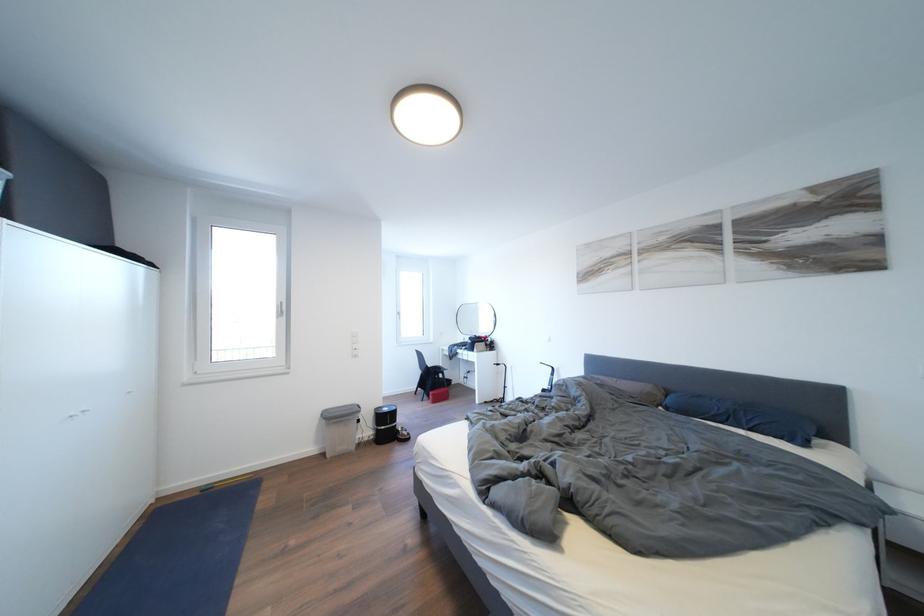
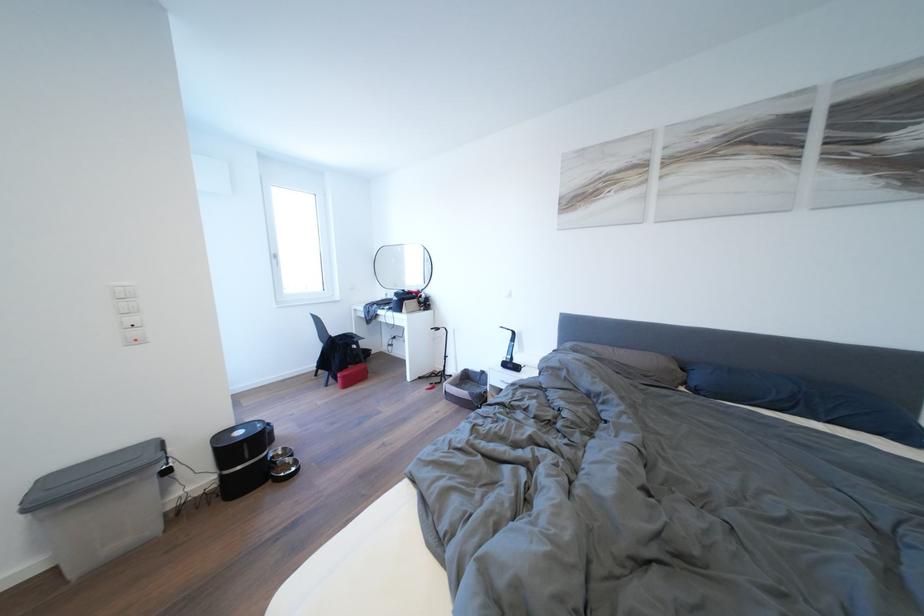
Question: Which direction would the cameraman need to move to produce the second image? Reply with the corresponding letter.

Choices:
 (A) Left
 (B) Right
 (C) Forward
 (D) Backward

Answer: (C)